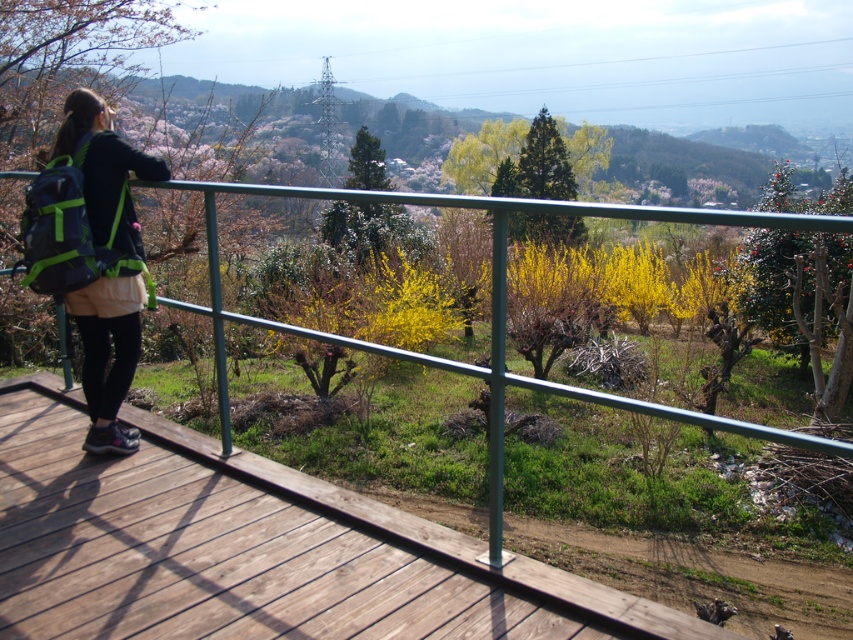
Between brown wooden deck at lower left and matte black backpack at left, which one has more height?

Standing taller between the two is matte black backpack at left.

Where is `brown wooden deck at lower left`? The width and height of the screenshot is (853, 640). brown wooden deck at lower left is located at coordinates (251, 548).

Where is `brown wooden deck at lower left`? This screenshot has width=853, height=640. brown wooden deck at lower left is located at coordinates click(251, 548).